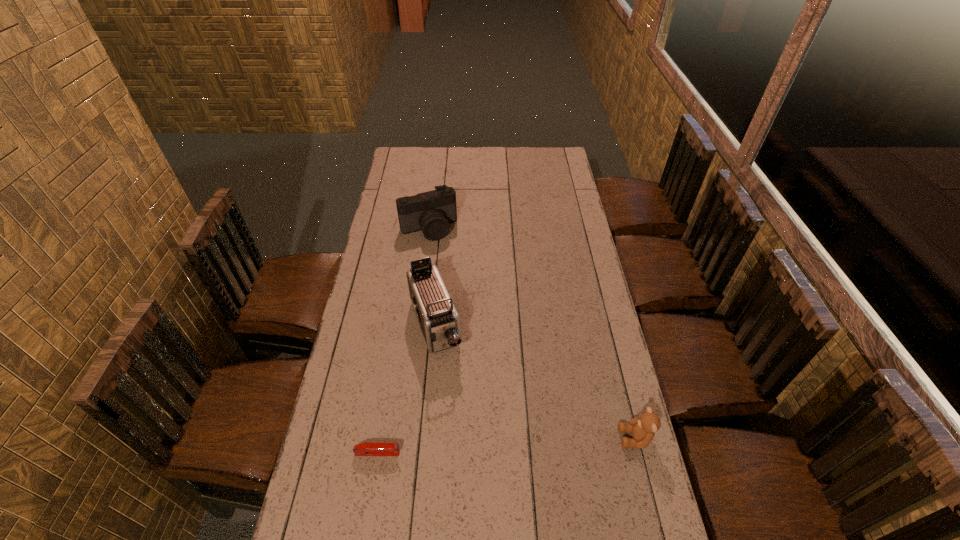
Locate an element on the screen. Image resolution: width=960 pixels, height=540 pixels. free space on the desktop that is between the stapler and the rightmost object and is positioned at the lens of the tallest object is located at coordinates (483, 447).

This screenshot has height=540, width=960. Identify the location of free space on the desktop that is between the stapler and the third tallest object and is positioned at the lens of the camera. (531, 444).